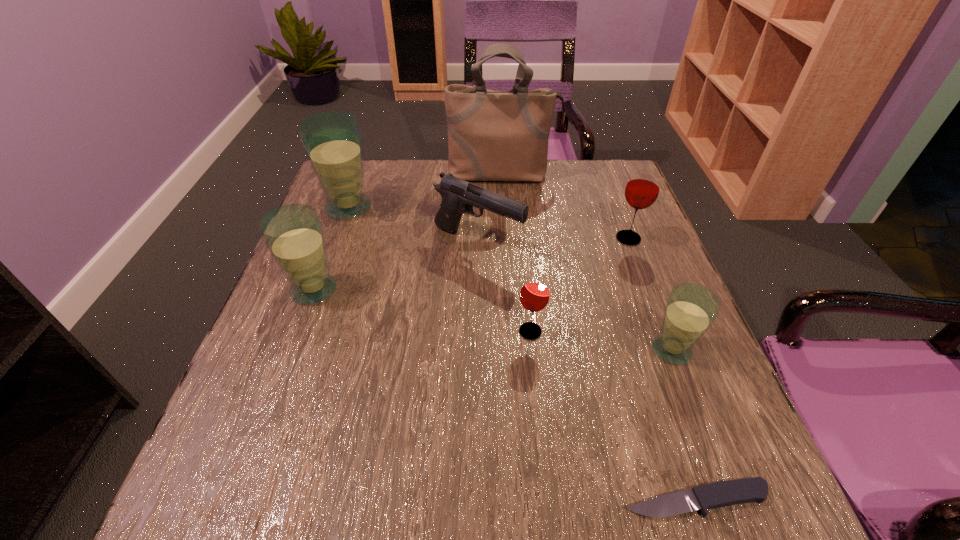
Find the location of `blank space located on the right of the third glass from right to left`. blank space located on the right of the third glass from right to left is located at coordinates (582, 332).

You are a GUI agent. You are given a task and a screenshot of the screen. Output one action in this format:
    pyautogui.click(x=<x>, y=<y>)
    Task: Click on the free location located 0.050m on the back of the rightmost blue glass
    The image size is (960, 540).
    Given the screenshot: What is the action you would take?
    pyautogui.click(x=658, y=313)

Find the location of `vacant space situated on the back of the steak knife`. vacant space situated on the back of the steak knife is located at coordinates (649, 361).

This screenshot has width=960, height=540. I want to click on shoulder bag that is at the far edge, so click(x=493, y=135).

This screenshot has height=540, width=960. In order to click on glass that is positioned at the far edge in this screenshot , I will do click(332, 140).

What are the coordinates of `object located at the near edge` in the screenshot? It's located at (726, 493).

Locate an element on the screen. steak knife that is at the right edge is located at coordinates (726, 493).

You are a GUI agent. You are given a task and a screenshot of the screen. Output one action in this format:
    pyautogui.click(x=<x>, y=<y>)
    Task: Click on the object that is at the far left corner
    
    Given the screenshot: What is the action you would take?
    pyautogui.click(x=332, y=140)

The width and height of the screenshot is (960, 540). In order to click on object located in the near right corner section of the desktop in this screenshot , I will do `click(726, 493)`.

The width and height of the screenshot is (960, 540). What are the coordinates of `vacant space at the far edge of the desktop` in the screenshot? It's located at (557, 193).